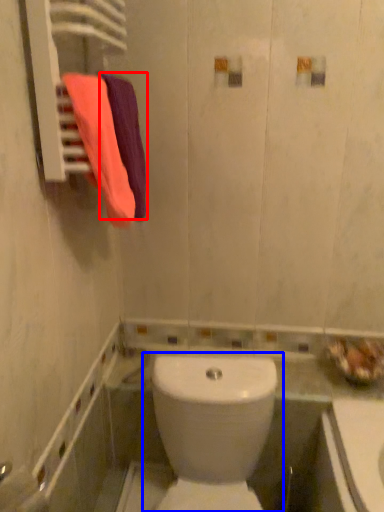
Question: Which of the following is the farthest to the observer, bath towel (highlighted by a red box) or toilet (highlighted by a blue box)?

Choices:
 (A) bath towel
 (B) toilet

Answer: (A)